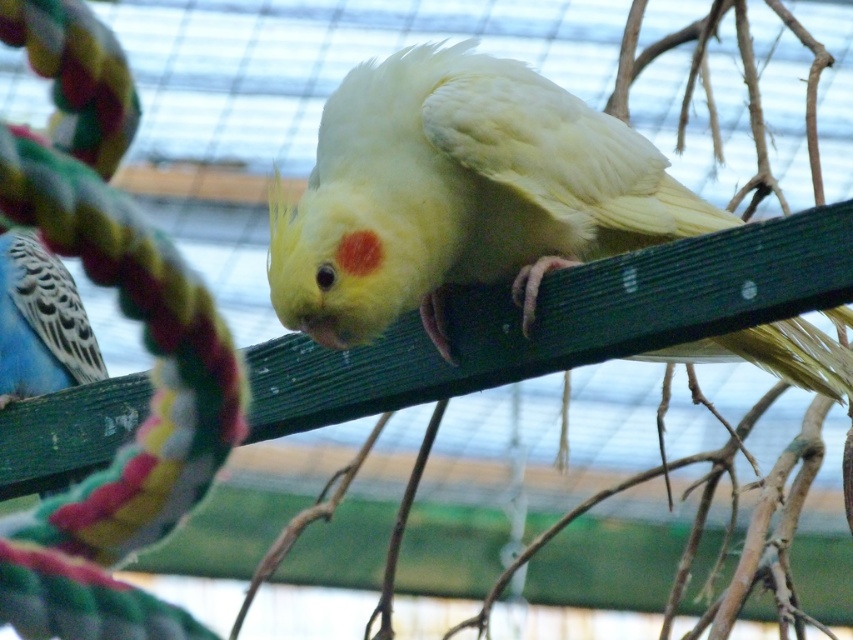
You are a bird enthusiast observing two parrots in a cage. You see a white feathered parrot at center and a blue speckled parrot at left. Which parrot is positioned more to the left side of the cage?

The blue speckled parrot at left is positioned more to the left side of the cage than the white feathered parrot at center.